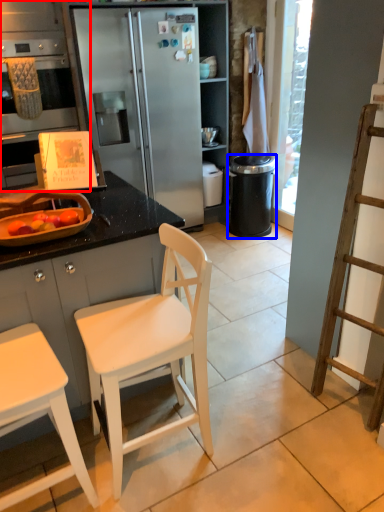
Question: Which object appears closest to the camera in this image, cabinetry (highlighted by a red box) or trash bin/can (highlighted by a blue box)?

Choices:
 (A) cabinetry
 (B) trash bin/can

Answer: (A)